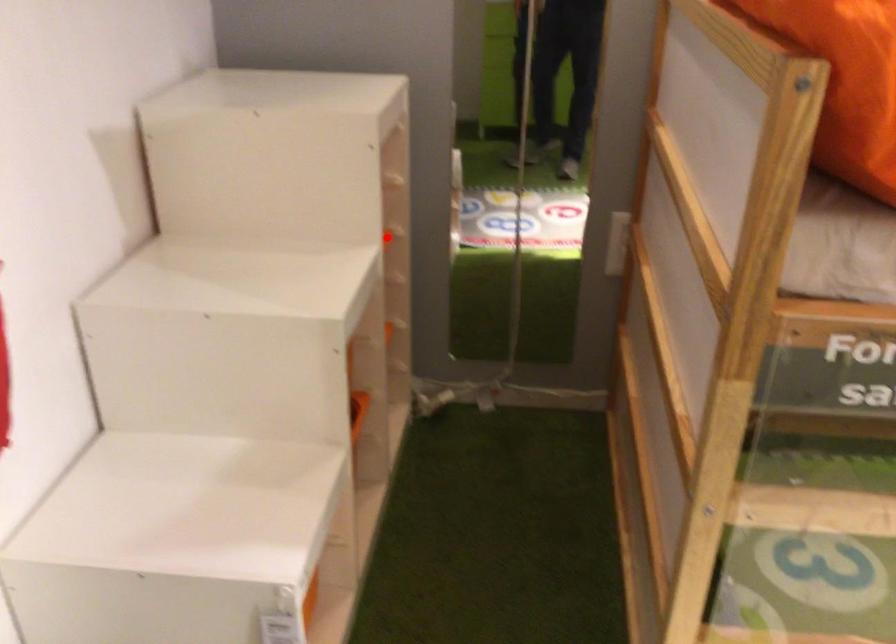
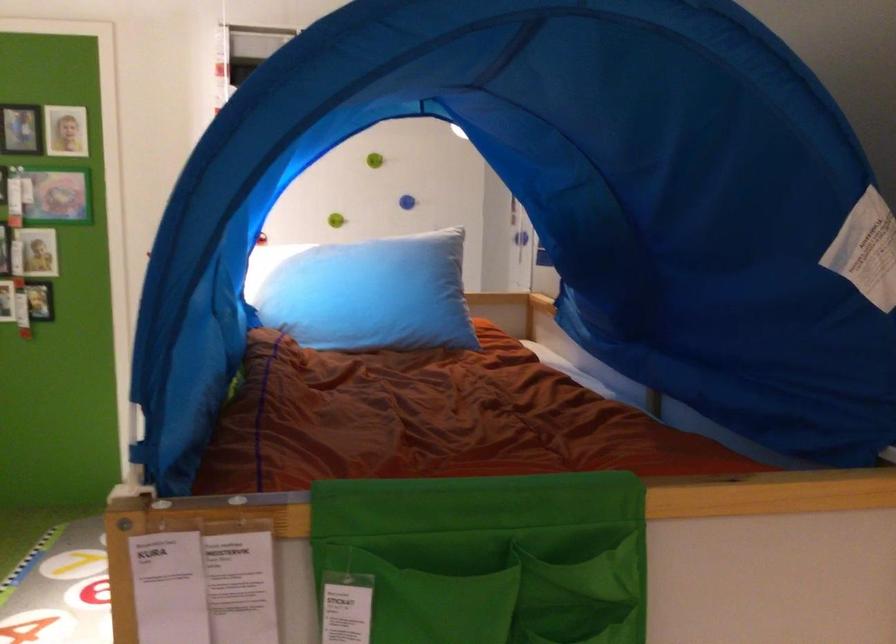
Question: I am providing you with two images of the same scene from different viewpoints. A red point is marked on the first image. Can you still see the location of the red point in image 2?

Choices:
 (A) Yes
 (B) No

Answer: (B)